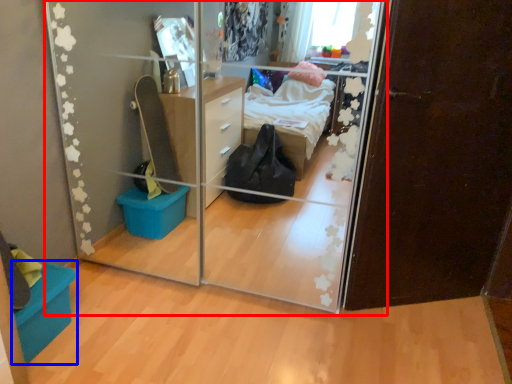
Question: Which object is further to the camera taking this photo, glass door (highlighted by a red box) or storage box (highlighted by a blue box)?

Choices:
 (A) glass door
 (B) storage box

Answer: (B)